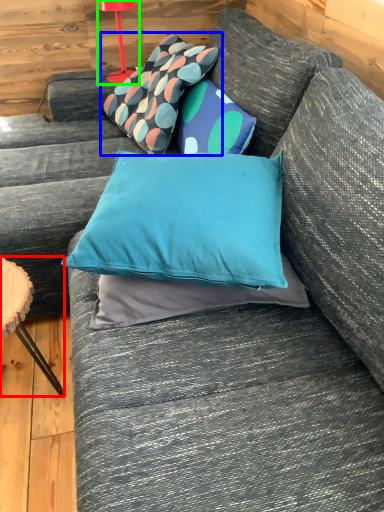
Question: Which is farther away from furniture (highlighted by a red box)? pillow (highlighted by a blue box) or table lamp (highlighted by a green box)?

Choices:
 (A) pillow
 (B) table lamp

Answer: (B)